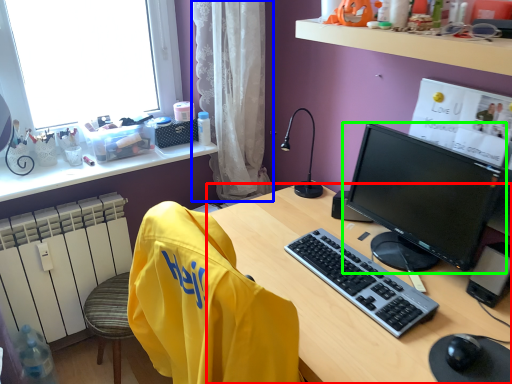
Question: Considering the real-world distances, which object is closest to desk (highlighted by a red box)? curtain (highlighted by a blue box) or computer monitor (highlighted by a green box).

Choices:
 (A) curtain
 (B) computer monitor

Answer: (B)